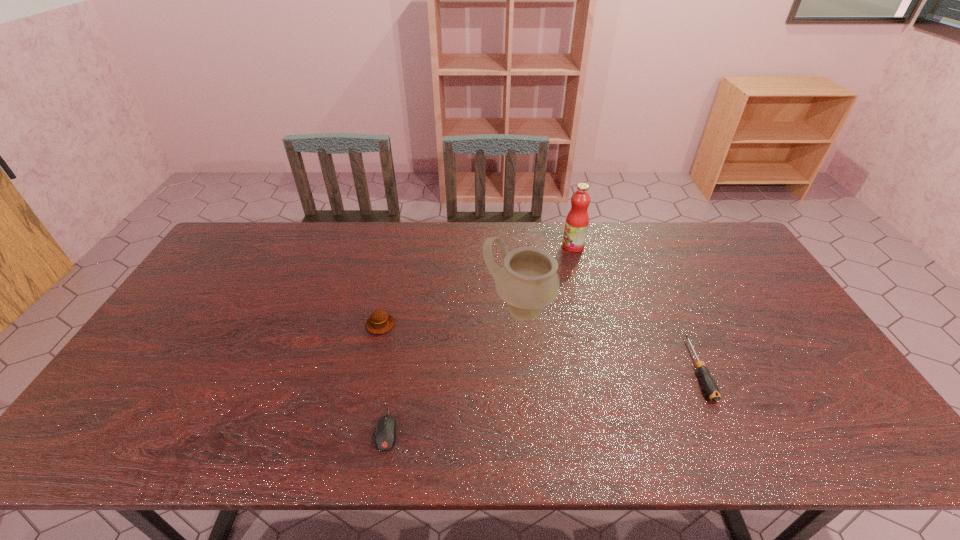
In order to click on vacant region at the right edge of the desktop in this screenshot , I will do `click(747, 275)`.

I want to click on vacant position at the far left corner of the desktop, so 254,238.

Where is `free space at the near left corner of the desktop`? The height and width of the screenshot is (540, 960). free space at the near left corner of the desktop is located at coordinates (100, 429).

Find the location of a particular element. The height and width of the screenshot is (540, 960). vacant area at the far right corner is located at coordinates (732, 239).

Find the location of a particular element. blank region between the rightmost object and the farthest object is located at coordinates (636, 308).

The height and width of the screenshot is (540, 960). Find the location of `free spot between the second object from right to left and the muffin`. free spot between the second object from right to left and the muffin is located at coordinates (477, 285).

You are a GUI agent. You are given a task and a screenshot of the screen. Output one action in this format:
    pyautogui.click(x=<x>, y=<y>)
    Task: Click on the vacant space that's between the rightmost object and the fourth object from left to right
    The image size is (960, 540).
    Given the screenshot: What is the action you would take?
    pyautogui.click(x=636, y=308)

Identify the location of free space that is in between the nearest object and the muffin. The height and width of the screenshot is (540, 960). (384, 377).

Where is `free space between the third object from left to right and the fourth object from right to left`? This screenshot has height=540, width=960. free space between the third object from left to right and the fourth object from right to left is located at coordinates (453, 369).

Find the location of a particular element. Image resolution: width=960 pixels, height=540 pixels. free area in between the second object from left to right and the fruit juice is located at coordinates (480, 338).